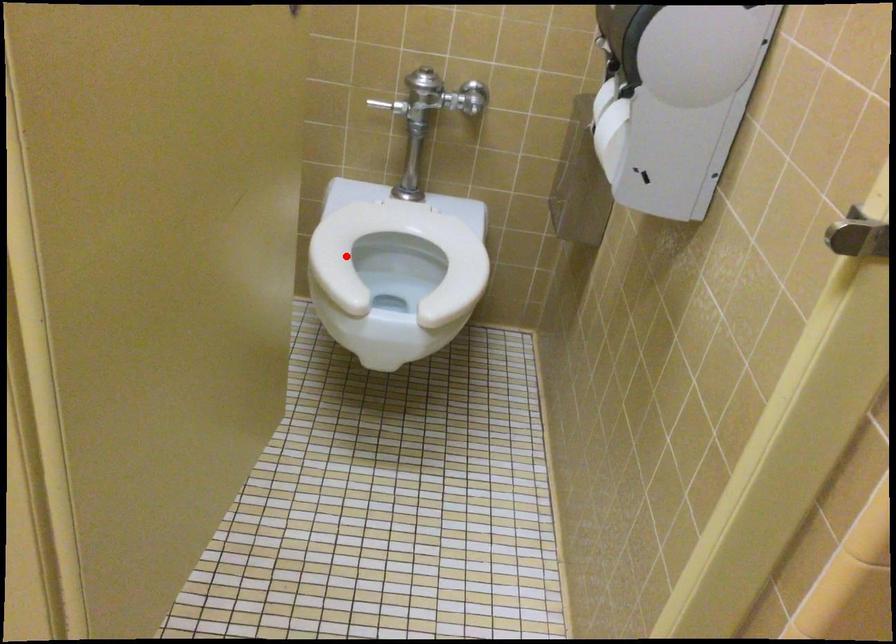
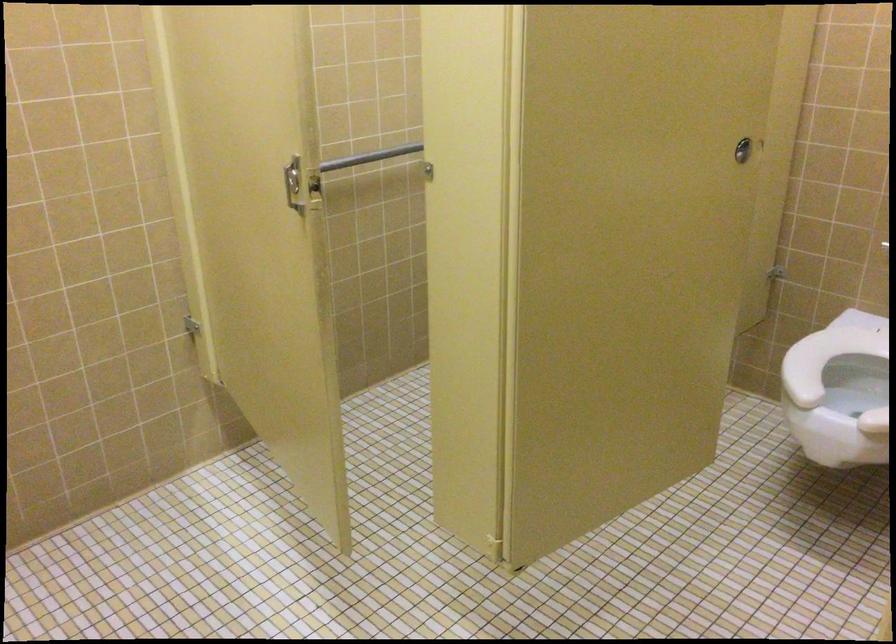
Question: I am providing you with two images of the same scene from different viewpoints. A red point is shown in image1. For the corresponding object point in image2, is it positioned nearer or farther from the camera?

Choices:
 (A) Nearer
 (B) Farther

Answer: (B)